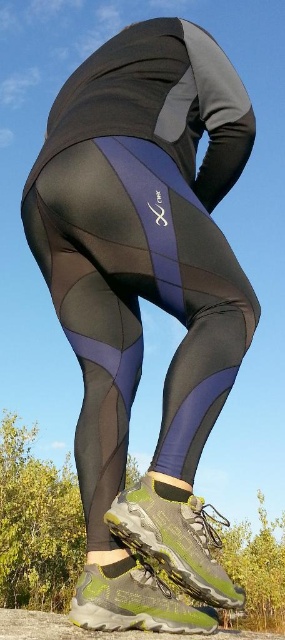
Who is positioned more to the right, green mesh shoe at lower center or green textured hiking boot at lower center?

Positioned to the right is green mesh shoe at lower center.

Is point (174, 557) farther from camera compared to point (171, 593)?

No, it is not.

The height and width of the screenshot is (640, 285). I want to click on green mesh shoe at lower center, so click(174, 538).

Image resolution: width=285 pixels, height=640 pixels. What are the coordinates of `green mesh shoe at lower center` in the screenshot? It's located at (174, 538).